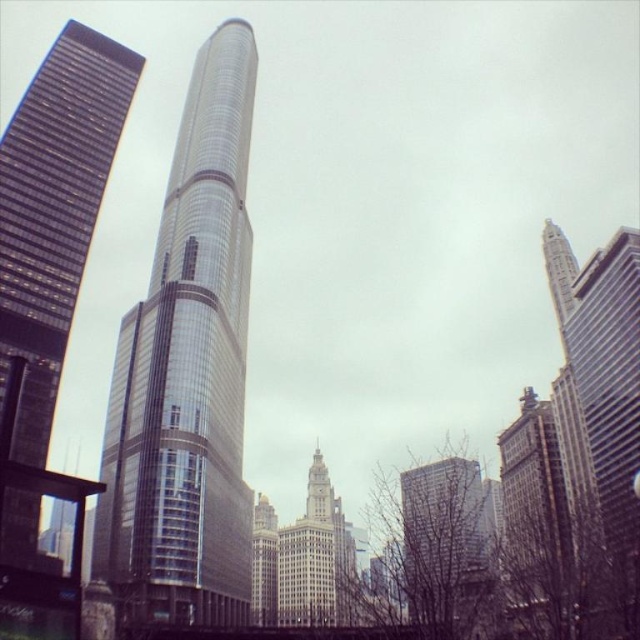
Question: Considering the relative positions of shiny glass skyscraper at center and glassy reflective skyscraper at left in the image provided, where is shiny glass skyscraper at center located with respect to glassy reflective skyscraper at left?

Choices:
 (A) left
 (B) right

Answer: (B)

Question: Which of these objects is positioned farthest from the shiny glass skyscraper at center?

Choices:
 (A) metallic glass skyscraper at center
 (B) brick building at center
 (C) glassy reflective skyscraper at left

Answer: (B)

Question: Is glassy reflective skyscraper at left closer to the viewer compared to metallic glass skyscraper at center?

Choices:
 (A) no
 (B) yes

Answer: (A)

Question: Which object appears closest to the camera in this image?

Choices:
 (A) brick building at center
 (B) glassy reflective skyscraper at left

Answer: (A)

Question: Which of the following is the closest to the observer?

Choices:
 (A) glassy reflective skyscraper at left
 (B) metallic glass skyscraper at center
 (C) shiny glass skyscraper at center
 (D) brick building at center

Answer: (B)

Question: Is shiny glass skyscraper at center to the right of metallic glass skyscraper at center from the viewer's perspective?

Choices:
 (A) no
 (B) yes

Answer: (A)